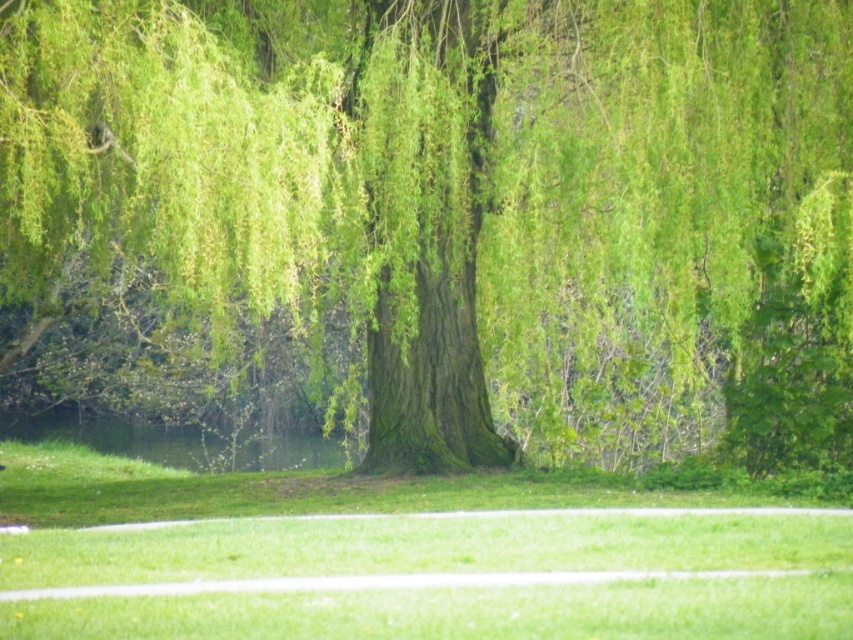
You are standing at the base of the large tree with drooping branches in the image. You see two points marked on the ground in front of you. One is at point (102, 154) and the other at point (96, 497). If you want to walk towards the point that is closer to you, which point should you head towards?

Point (102, 154) is in front of point (96, 497), so the closer point to you is point (102, 154). You should head towards point (102, 154).

You are a gardener who wants to plant a new flower bed between the green leafy willow at center and the green grass at lower center. Considering their sizes, which object would cast more shade over the flower bed?

The green leafy willow at center is much taller than the green grass at lower center, so it would cast more shade over the flower bed.